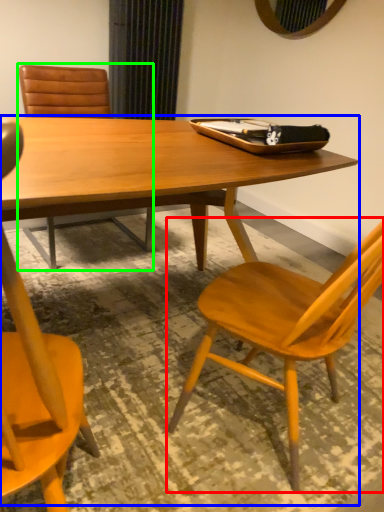
Question: Which object is the closest to the chair (highlighted by a red box)? Choose among these: round table (highlighted by a blue box) or chair (highlighted by a green box).

Choices:
 (A) round table
 (B) chair

Answer: (A)